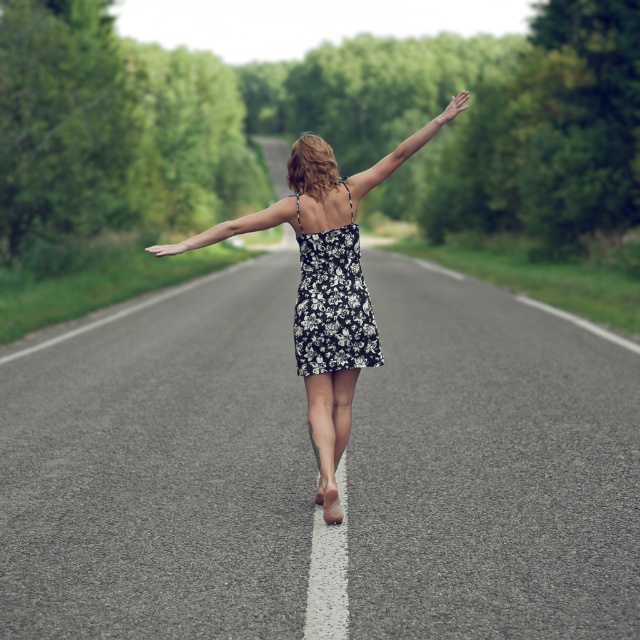
From the picture: Who is lower down, floral-patterned fabric dress at center or smooth skin hand at upper right?

floral-patterned fabric dress at center

Is point (328, 291) closer to camera compared to point (444, 116)?

No, (328, 291) is further to viewer.

You are a GUI agent. You are given a task and a screenshot of the screen. Output one action in this format:
    pyautogui.click(x=<x>, y=<y>)
    Task: Click on the floral-patterned fabric dress at center
    The image size is (640, 640).
    Given the screenshot: What is the action you would take?
    pyautogui.click(x=332, y=304)

Is the position of floral-patterned fabric dress at center less distant than that of smooth skin arm at center?

No, it is behind smooth skin arm at center.

Is floral-patterned fabric dress at center bigger than smooth skin arm at center?

Actually, floral-patterned fabric dress at center might be smaller than smooth skin arm at center.

You are a GUI agent. You are given a task and a screenshot of the screen. Output one action in this format:
    pyautogui.click(x=<x>, y=<y>)
    Task: Click on the floral-patterned fabric dress at center
    
    Given the screenshot: What is the action you would take?
    pyautogui.click(x=332, y=304)

Locate an element on the screen. The width and height of the screenshot is (640, 640). floral-patterned fabric dress at center is located at coordinates (332, 304).

The image size is (640, 640). Describe the element at coordinates (326, 289) in the screenshot. I see `floral dress at center` at that location.

Who is more distant from viewer, (314, 372) or (291, 209)?

Point (291, 209)

This screenshot has height=640, width=640. I want to click on floral dress at center, so click(326, 289).